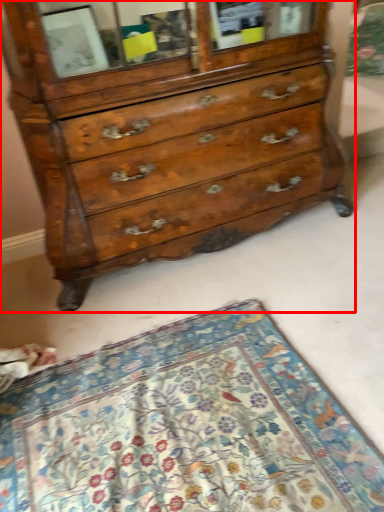
Question: From the image's perspective, what is the correct spatial relationship of chest of drawers (annotated by the red box) in relation to mat?

Choices:
 (A) below
 (B) above

Answer: (B)